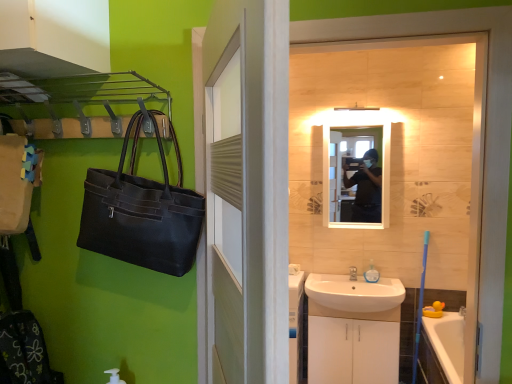
Question: Is white wood door at center bigger than white ceramic sink at lower center?

Choices:
 (A) no
 (B) yes

Answer: (B)

Question: Is white ceramic sink at lower center completely or partially inside white wood door at center?

Choices:
 (A) no
 (B) yes

Answer: (A)

Question: Is white wood door at center oriented towards white ceramic sink at lower center?

Choices:
 (A) no
 (B) yes

Answer: (A)

Question: From the image's perspective, is white wood door at center beneath white ceramic sink at lower center?

Choices:
 (A) yes
 (B) no

Answer: (B)

Question: Is white wood door at center in front of white ceramic sink at lower center?

Choices:
 (A) yes
 (B) no

Answer: (A)

Question: In the image, is white wood door at center on the left side or the right side of silver metallic faucet at sink right?

Choices:
 (A) right
 (B) left

Answer: (B)

Question: From the image's perspective, is white wood door at center above or below silver metallic faucet at sink right?

Choices:
 (A) above
 (B) below

Answer: (A)

Question: From a real-world perspective, is white wood door at center physically located above or below silver metallic faucet at sink right?

Choices:
 (A) above
 (B) below

Answer: (A)

Question: Does point (262, 180) appear closer or farther from the camera than point (353, 271)?

Choices:
 (A) closer
 (B) farther

Answer: (A)

Question: Looking at the image, does silver metallic faucet at sink right seem bigger or smaller compared to translucent plastic soap dispenser at sink?

Choices:
 (A) small
 (B) big

Answer: (A)

Question: From a real-world perspective, is silver metallic faucet at sink right physically located above or below translucent plastic soap dispenser at sink?

Choices:
 (A) below
 (B) above

Answer: (A)

Question: In the image, is silver metallic faucet at sink right positioned in front of or behind translucent plastic soap dispenser at sink?

Choices:
 (A) behind
 (B) front

Answer: (B)

Question: Is point (354, 266) closer or farther from the camera than point (370, 264)?

Choices:
 (A) closer
 (B) farther

Answer: (B)

Question: Considering their positions, is white glossy cabinet at lower center located in front of or behind silver metallic faucet at sink right?

Choices:
 (A) front
 (B) behind

Answer: (A)

Question: From the image's perspective, is white glossy cabinet at lower center above or below silver metallic faucet at sink right?

Choices:
 (A) below
 (B) above

Answer: (A)